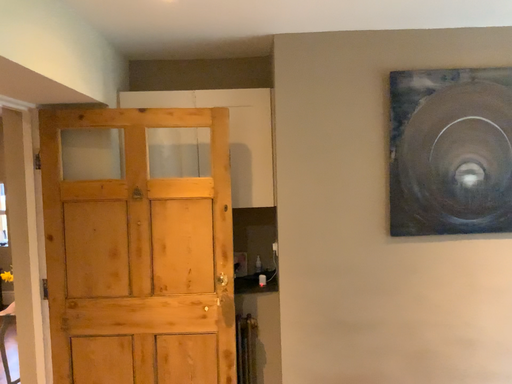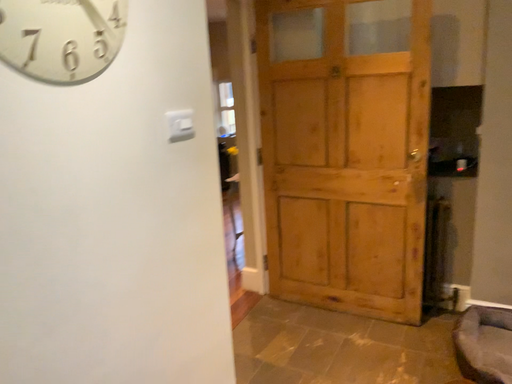
Question: How did the camera likely rotate when shooting the video?

Choices:
 (A) rotated downward
 (B) rotated upward

Answer: (A)